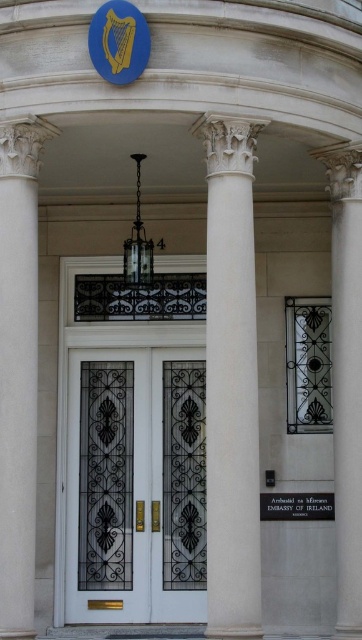
Question: Among these points, which one is nearest to the camera?

Choices:
 (A) (5, 422)
 (B) (228, 621)
 (C) (103, 392)

Answer: (B)

Question: Is the position of white glossy door at center less distant than that of white marble column at right?

Choices:
 (A) no
 (B) yes

Answer: (A)

Question: Among these objects, which one is nearest to the camera?

Choices:
 (A) white marble column at center
 (B) white marble column at right

Answer: (A)

Question: In this image, where is white glossy door at center located relative to white marble column at right?

Choices:
 (A) right
 (B) left

Answer: (B)

Question: From the image, what is the correct spatial relationship of white marble column at left in relation to white marble column at right?

Choices:
 (A) right
 (B) left

Answer: (B)

Question: Estimate the real-world distances between objects in this image. Which object is farther from the white marble column at center?

Choices:
 (A) white glossy door at center
 (B) white marble column at right

Answer: (B)